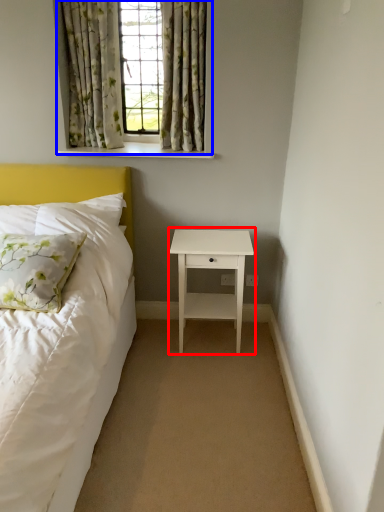
Question: Among these objects, which one is nearest to the camera, nightstand (highlighted by a red box) or window (highlighted by a blue box)?

Choices:
 (A) nightstand
 (B) window

Answer: (B)